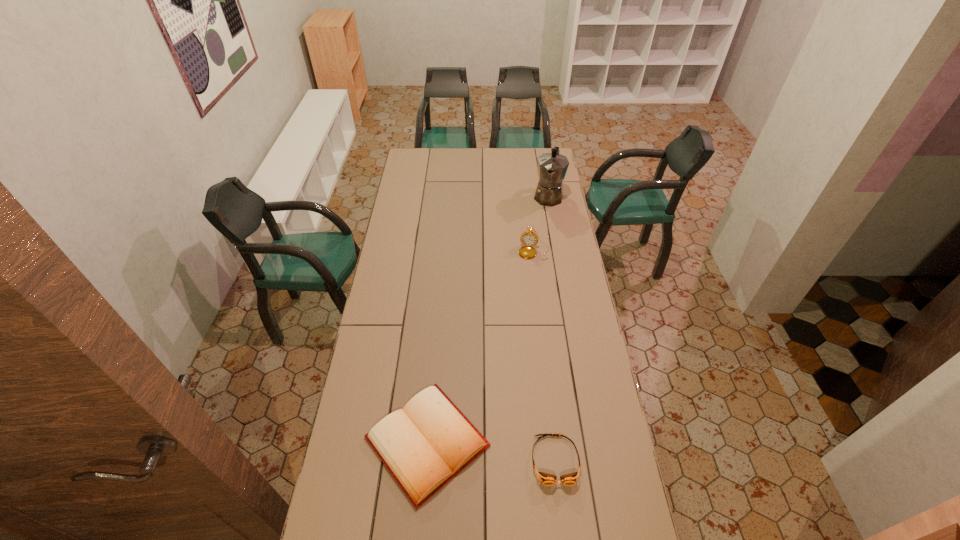
Locate an element on the screen. The height and width of the screenshot is (540, 960). vacant space located 0.140m on the pouring side of the farthest object is located at coordinates (542, 226).

The image size is (960, 540). What are the coordinates of `vacant area located on the face of the second tallest object` in the screenshot? It's located at (529, 280).

Find the location of `vacant space positioned on the face of the second tallest object`. vacant space positioned on the face of the second tallest object is located at coordinates (525, 305).

I want to click on free space located on the face of the second tallest object, so click(x=523, y=317).

What are the coordinates of `object that is at the near edge` in the screenshot? It's located at (424, 445).

I want to click on object that is at the left edge, so click(424, 445).

Image resolution: width=960 pixels, height=540 pixels. In order to click on goggles that is at the right edge in this screenshot , I will do `click(546, 479)`.

Image resolution: width=960 pixels, height=540 pixels. What are the coordinates of `coffeepot that is at the right edge` in the screenshot? It's located at (552, 167).

The width and height of the screenshot is (960, 540). Find the location of `pocket watch at the right edge`. pocket watch at the right edge is located at coordinates (528, 238).

This screenshot has width=960, height=540. In order to click on object situated at the near left corner in this screenshot , I will do `click(424, 445)`.